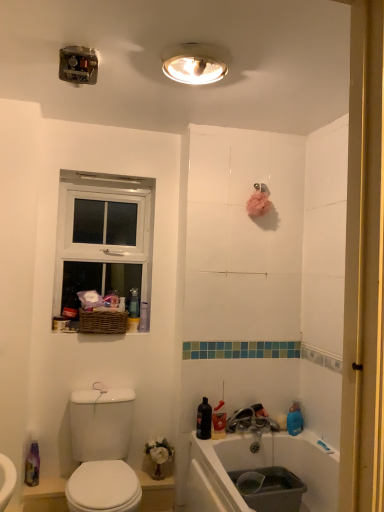
Question: Is white wooden window at upper left completely or partially outside of woven brown basket at upper left?

Choices:
 (A) yes
 (B) no

Answer: (A)

Question: Is white wooden window at upper left far away from woven brown basket at upper left?

Choices:
 (A) yes
 (B) no

Answer: (B)

Question: Can you confirm if white wooden window at upper left is positioned to the left of woven brown basket at upper left?

Choices:
 (A) no
 (B) yes

Answer: (B)

Question: Can you confirm if white wooden window at upper left is positioned to the right of woven brown basket at upper left?

Choices:
 (A) yes
 (B) no

Answer: (B)

Question: Does white wooden window at upper left lie in front of woven brown basket at upper left?

Choices:
 (A) yes
 (B) no

Answer: (B)

Question: From the image's perspective, is translucent plastic spray bottle at lower left located above or below matte plastic container at left?

Choices:
 (A) below
 (B) above

Answer: (A)

Question: Considering the positions of translucent plastic spray bottle at lower left and matte plastic container at left in the image, is translucent plastic spray bottle at lower left taller or shorter than matte plastic container at left?

Choices:
 (A) tall
 (B) short

Answer: (A)

Question: Is translucent plastic spray bottle at lower left wider or thinner than matte plastic container at left?

Choices:
 (A) wide
 (B) thin

Answer: (B)

Question: In the image, is translucent plastic spray bottle at lower left positioned in front of or behind matte plastic container at left?

Choices:
 (A) front
 (B) behind

Answer: (A)

Question: Visually, is metallic silver faucet at lower center positioned to the left or to the right of white wooden window at upper left?

Choices:
 (A) left
 (B) right

Answer: (B)

Question: From the image's perspective, relative to white wooden window at upper left, is metallic silver faucet at lower center above or below?

Choices:
 (A) above
 (B) below

Answer: (B)

Question: In terms of width, does metallic silver faucet at lower center look wider or thinner when compared to white wooden window at upper left?

Choices:
 (A) thin
 (B) wide

Answer: (B)

Question: Relative to white wooden window at upper left, is metallic silver faucet at lower center in front or behind?

Choices:
 (A) front
 (B) behind

Answer: (A)

Question: In the image, is white glossy toilet at lower left positioned in front of or behind matte plastic container at left?

Choices:
 (A) behind
 (B) front

Answer: (B)

Question: Considering the positions of point click(x=82, y=457) and point click(x=64, y=320), is point click(x=82, y=457) closer or farther from the camera than point click(x=64, y=320)?

Choices:
 (A) closer
 (B) farther

Answer: (A)